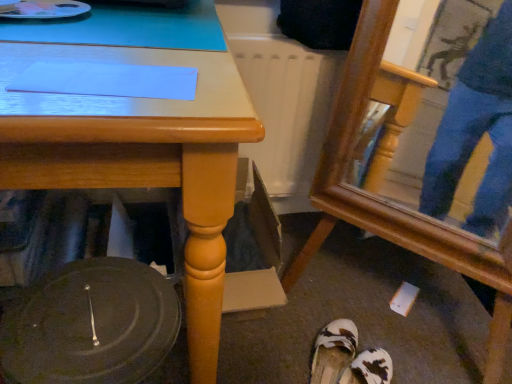
Question: In which direction should I rotate to look at white textured sandals at lower center, the second footwear when ordered from top to bottom?

Choices:
 (A) left
 (B) right

Answer: (B)

Question: Can you confirm if wooden swivel chair at lower right is positioned to the right of white fabric sandals at lower center, which ranks as the second footwear in bottom-to-top order?

Choices:
 (A) yes
 (B) no

Answer: (A)

Question: Considering the relative sizes of wooden swivel chair at lower right and white fabric sandals at lower center, which ranks as the second footwear in bottom-to-top order, in the image provided, is wooden swivel chair at lower right taller than white fabric sandals at lower center, which ranks as the second footwear in bottom-to-top order,?

Choices:
 (A) no
 (B) yes

Answer: (B)

Question: Can you confirm if wooden swivel chair at lower right is shorter than white fabric sandals at lower center, the first footwear in the top-to-bottom sequence?

Choices:
 (A) yes
 (B) no

Answer: (B)

Question: From a real-world perspective, is wooden swivel chair at lower right under white fabric sandals at lower center, the first footwear in the top-to-bottom sequence?

Choices:
 (A) no
 (B) yes

Answer: (A)

Question: Is white fabric sandals at lower center, the first footwear in the top-to-bottom sequence, inside wooden swivel chair at lower right?

Choices:
 (A) yes
 (B) no

Answer: (B)

Question: Does wooden swivel chair at lower right have a lesser width compared to white fabric sandals at lower center, the first footwear in the top-to-bottom sequence?

Choices:
 (A) no
 (B) yes

Answer: (A)

Question: Can you confirm if white fabric sandals at lower center, the first footwear in the top-to-bottom sequence, is bigger than matte wood desk at center?

Choices:
 (A) no
 (B) yes

Answer: (A)

Question: Does white fabric sandals at lower center, which ranks as the second footwear in bottom-to-top order, contain matte wood desk at center?

Choices:
 (A) no
 (B) yes

Answer: (A)

Question: Considering the relative sizes of white fabric sandals at lower center, which ranks as the second footwear in bottom-to-top order, and matte wood desk at center in the image provided, is white fabric sandals at lower center, which ranks as the second footwear in bottom-to-top order, thinner than matte wood desk at center?

Choices:
 (A) no
 (B) yes

Answer: (B)

Question: From the image's perspective, does white fabric sandals at lower center, the first footwear in the top-to-bottom sequence, appear higher than matte wood desk at center?

Choices:
 (A) no
 (B) yes

Answer: (A)

Question: Is the depth of white fabric sandals at lower center, the first footwear in the top-to-bottom sequence, less than that of matte wood desk at center?

Choices:
 (A) yes
 (B) no

Answer: (B)

Question: Is white fabric sandals at lower center, which ranks as the second footwear in bottom-to-top order, far away from matte wood desk at center?

Choices:
 (A) yes
 (B) no

Answer: (B)

Question: Does white fabric sandals at lower center, the first footwear in the top-to-bottom sequence, have a lesser width compared to white textured sandals at lower center, which is the 1th footwear in bottom-to-top order?

Choices:
 (A) no
 (B) yes

Answer: (B)